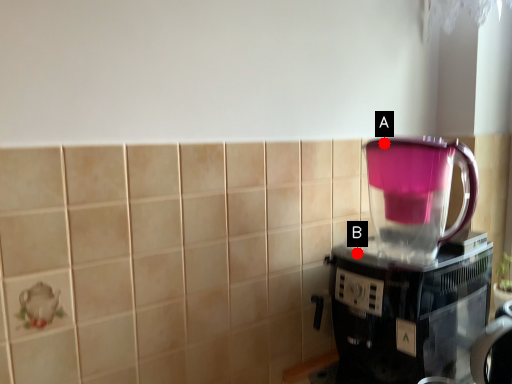
Question: Two points are circled on the image, labeled by A and B beside each circle. Which of the following is the closest to the observer?

Choices:
 (A) A is closer
 (B) B is closer

Answer: (A)